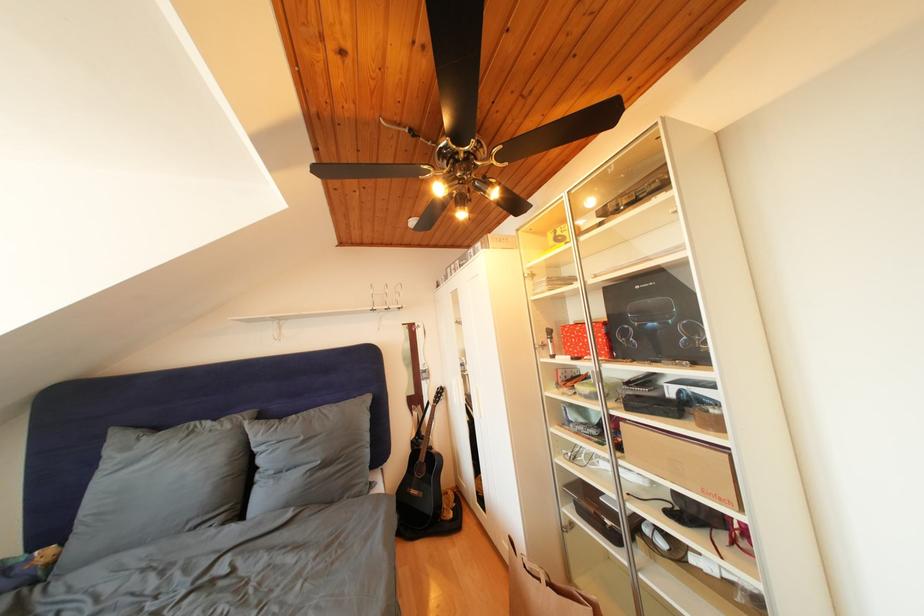
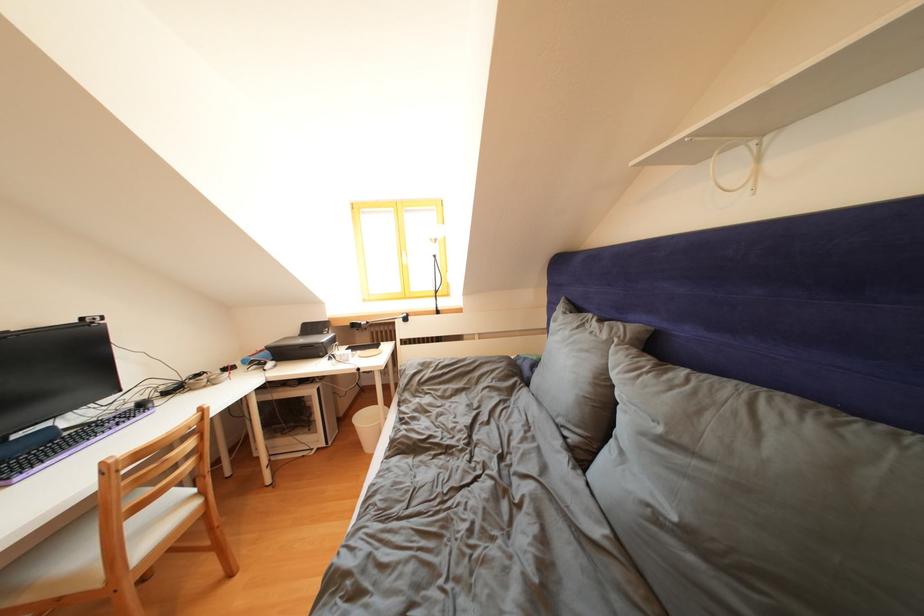
Find the pixel in the second image that matches [236,432] in the first image.

(612, 341)